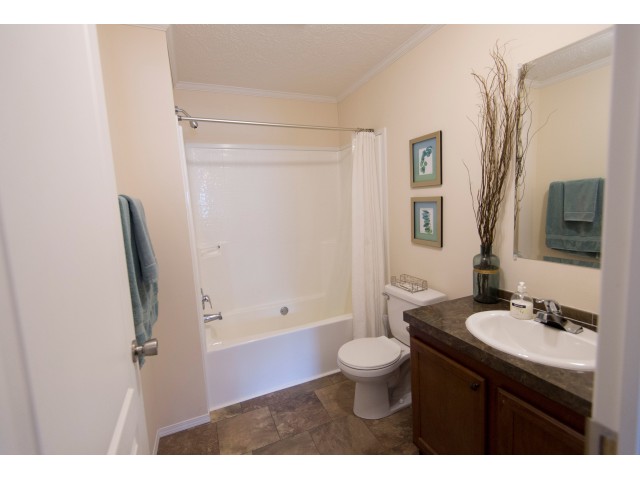
The height and width of the screenshot is (480, 640). I want to click on faucet, so click(x=548, y=312), click(x=223, y=313).